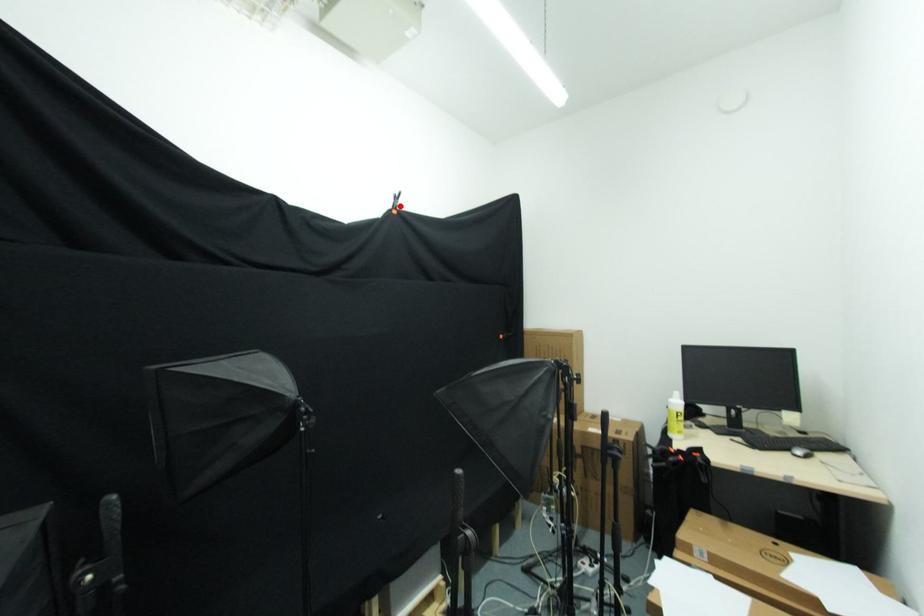
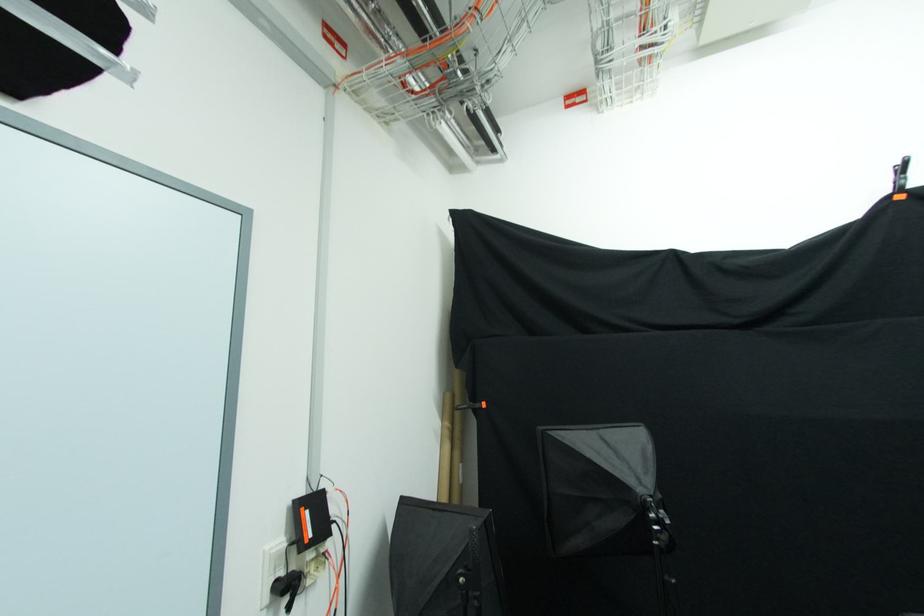
Locate, in the second image, the point that corresponds to the highlighted location in the first image.

(904, 180)